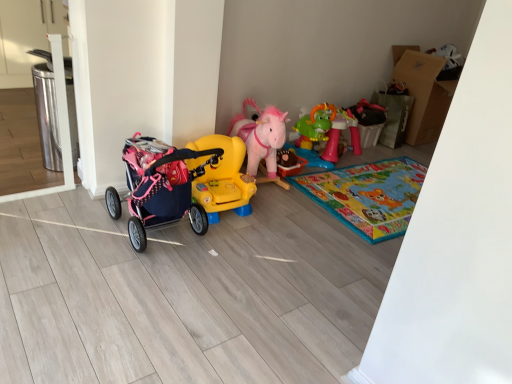
Question: Is the depth of pink fabric stroller at left, the 1th toy when ordered from left to right, less than that of yellow plastic ride-on car at center, which is the third toy in right-to-left order?

Choices:
 (A) yes
 (B) no

Answer: (A)

Question: Is pink fabric stroller at left, the 1th toy when ordered from left to right, touching yellow plastic ride-on car at center, which is the third toy in right-to-left order?

Choices:
 (A) no
 (B) yes

Answer: (A)

Question: From a real-world perspective, is pink fabric stroller at left, the 1th toy when ordered from left to right, over yellow plastic ride-on car at center, the 2th toy positioned from the left?

Choices:
 (A) yes
 (B) no

Answer: (A)

Question: Considering the relative positions of pink fabric stroller at left, which is counted as the 4th toy, starting from the right, and yellow plastic ride-on car at center, the 2th toy positioned from the left, in the image provided, is pink fabric stroller at left, which is counted as the 4th toy, starting from the right, to the left of yellow plastic ride-on car at center, the 2th toy positioned from the left, from the viewer's perspective?

Choices:
 (A) yes
 (B) no

Answer: (A)

Question: From the image's perspective, is pink fabric stroller at left, the 1th toy when ordered from left to right, on yellow plastic ride-on car at center, which is the third toy in right-to-left order?

Choices:
 (A) no
 (B) yes

Answer: (A)

Question: Considering the relative sizes of pink fabric stroller at left, which is counted as the 4th toy, starting from the right, and yellow plastic ride-on car at center, which is the third toy in right-to-left order, in the image provided, is pink fabric stroller at left, which is counted as the 4th toy, starting from the right, thinner than yellow plastic ride-on car at center, which is the third toy in right-to-left order,?

Choices:
 (A) no
 (B) yes

Answer: (A)

Question: Is rubberized green dinosaur table at center-right, which ranks as the 4th toy in left-to-right order, wider than pink plush horse at center, marked as the 2th toy in a right-to-left arrangement?

Choices:
 (A) no
 (B) yes

Answer: (A)

Question: Is rubberized green dinosaur table at center-right, which ranks as the 4th toy in left-to-right order, positioned with its back to pink plush horse at center, placed as the third toy when sorted from left to right?

Choices:
 (A) no
 (B) yes

Answer: (A)

Question: Is rubberized green dinosaur table at center-right, acting as the first toy starting from the right, in front of pink plush horse at center, placed as the third toy when sorted from left to right?

Choices:
 (A) no
 (B) yes

Answer: (A)

Question: Is rubberized green dinosaur table at center-right, acting as the first toy starting from the right, far away from pink plush horse at center, marked as the 2th toy in a right-to-left arrangement?

Choices:
 (A) yes
 (B) no

Answer: (B)

Question: Can you confirm if rubberized green dinosaur table at center-right, which ranks as the 4th toy in left-to-right order, is smaller than pink plush horse at center, marked as the 2th toy in a right-to-left arrangement?

Choices:
 (A) no
 (B) yes

Answer: (B)

Question: Can you confirm if rubberized green dinosaur table at center-right, acting as the first toy starting from the right, is positioned to the left of pink plush horse at center, marked as the 2th toy in a right-to-left arrangement?

Choices:
 (A) no
 (B) yes

Answer: (A)

Question: Does yellow plastic ride-on car at center, the 2th toy positioned from the left, have a greater width compared to rubberized green dinosaur table at center-right, which ranks as the 4th toy in left-to-right order?

Choices:
 (A) yes
 (B) no

Answer: (B)